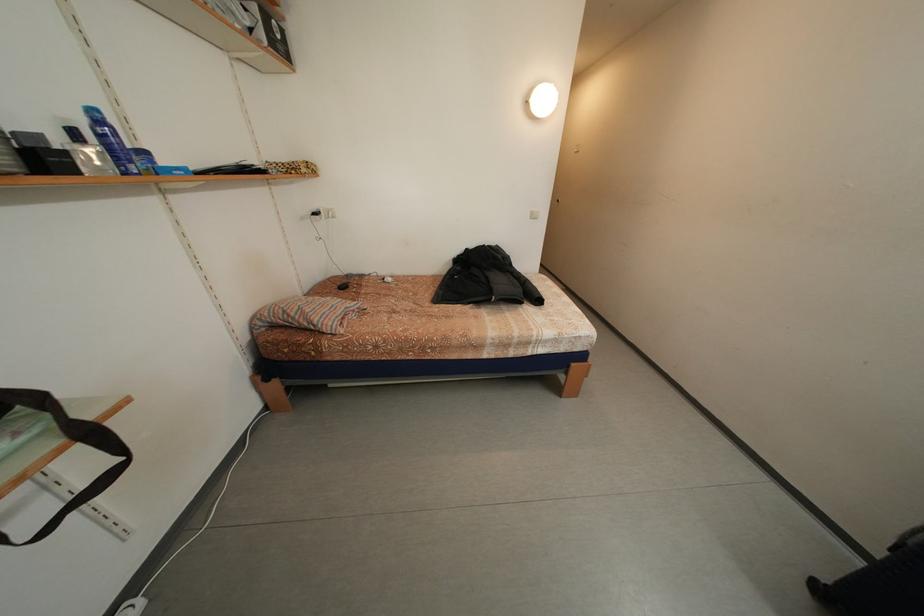
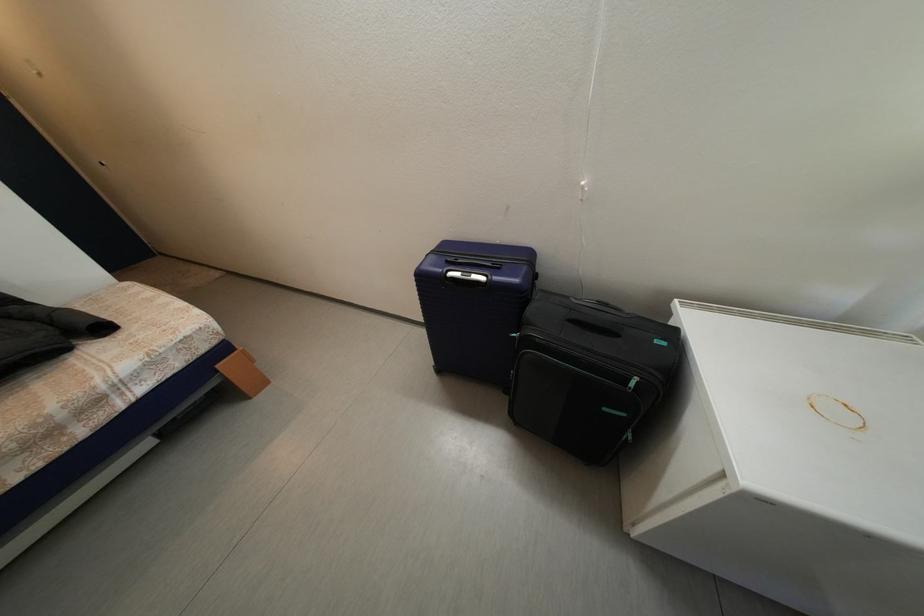
First-person continuous shooting, in which direction is the camera rotating?

The rotation direction of the camera is right-down.